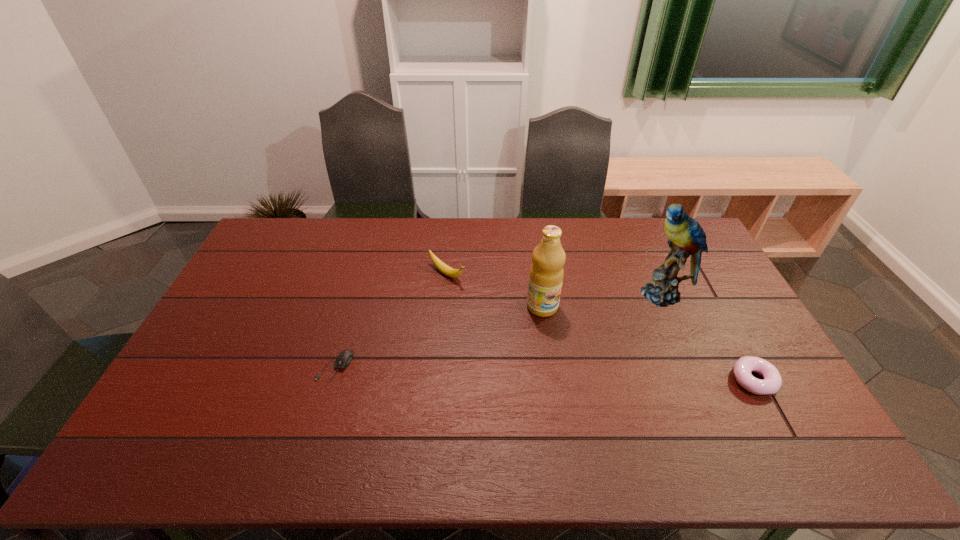
Locate an element on the screen. The width and height of the screenshot is (960, 540). mouse is located at coordinates (344, 359).

Identify the location of the leftmost object. Image resolution: width=960 pixels, height=540 pixels. pyautogui.click(x=344, y=359).

Find the location of a particular element. The image size is (960, 540). doughnut is located at coordinates (742, 369).

Find the location of a particular element. parrot is located at coordinates [686, 237].

The width and height of the screenshot is (960, 540). I want to click on the fourth object from right to left, so click(444, 268).

The height and width of the screenshot is (540, 960). Find the location of `the third tallest object`. the third tallest object is located at coordinates (444, 268).

You are a GUI agent. You are given a task and a screenshot of the screen. Output one action in this format:
    pyautogui.click(x=<x>, y=<y>)
    Task: Click on the fourth shortest object
    This screenshot has height=540, width=960.
    Given the screenshot: What is the action you would take?
    pyautogui.click(x=546, y=275)

What are the coordinates of `the third object from left to right` in the screenshot? It's located at (546, 275).

This screenshot has width=960, height=540. I want to click on free point located 0.220m on the left of the leftmost object, so click(x=240, y=367).

The width and height of the screenshot is (960, 540). Find the location of `free space located 0.380m on the left of the doughnut`. free space located 0.380m on the left of the doughnut is located at coordinates (592, 380).